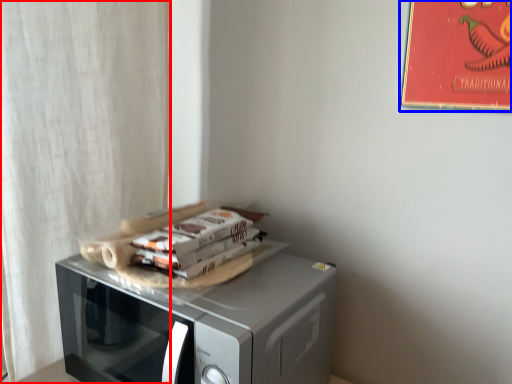
Question: Which of the following is the closest to the observer, curtain (highlighted by a red box) or bulletin board (highlighted by a blue box)?

Choices:
 (A) curtain
 (B) bulletin board

Answer: (B)